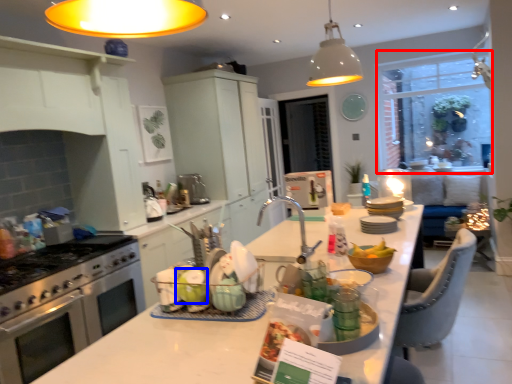
Question: Which object appears closest to the camera in this image, window screen (highlighted by a red box) or table (highlighted by a blue box)?

Choices:
 (A) window screen
 (B) table

Answer: (B)